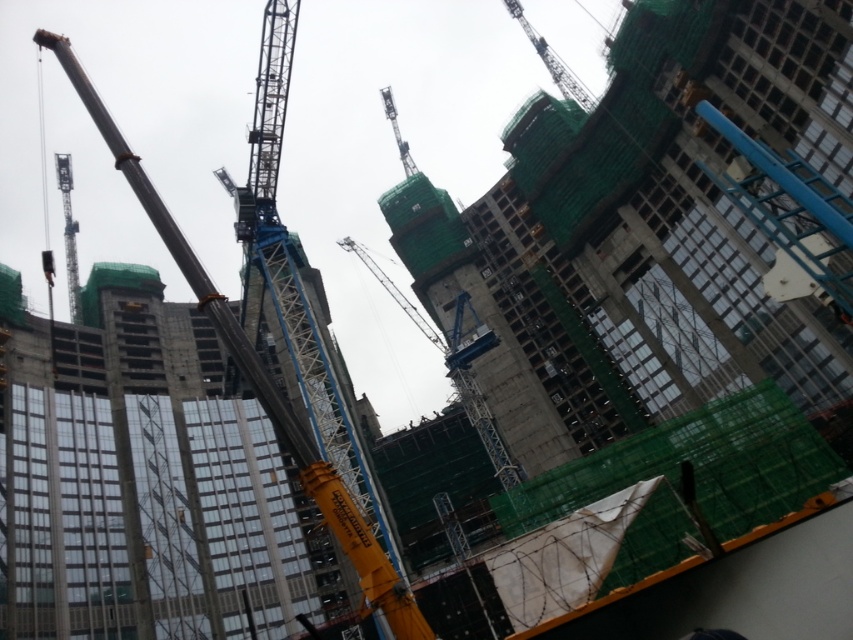
Question: Which point is farther to the camera?

Choices:
 (A) (387, 102)
 (B) (416, 317)

Answer: (A)

Question: Is blue metallic crane at center closer to camera compared to metallic blue crane at left?

Choices:
 (A) yes
 (B) no

Answer: (A)

Question: Is metallic blue crane at left above metallic blue crane at upper center?

Choices:
 (A) no
 (B) yes

Answer: (A)

Question: Is metallic blue crane at left to the right of metallic gray crane at center from the viewer's perspective?

Choices:
 (A) yes
 (B) no

Answer: (B)

Question: Which point is closer to the camera taking this photo?

Choices:
 (A) (401, 145)
 (B) (563, 90)
 (C) (651, 410)
 (D) (62, 200)

Answer: (C)

Question: Which of these objects is positioned closest to the metallic gray crane at center?

Choices:
 (A) metallic blue crane at upper center
 (B) green netted construction at upper center

Answer: (A)